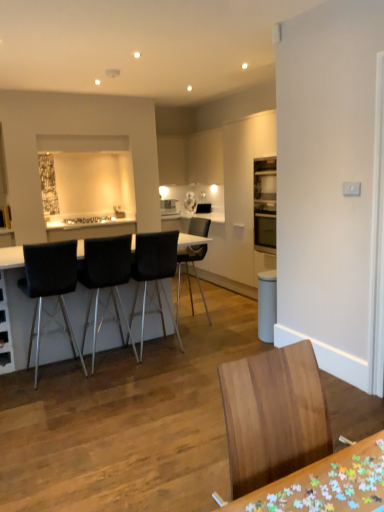
What is the approximate height of black leather chair at left, the 2th chair from the front?

The height of black leather chair at left, the 2th chair from the front, is 3.65 feet.

How much space does black leather bar stool at left, arranged as the 3th chair when viewed from the front, occupy horizontally?

It is 20.70 inches.

At what (x,y) coordinates should I click in order to perform the action: click on black leather chair at center, placed as the 5th chair when sorted from front to back. Please return your answer as a coordinate pair (x, y). Looking at the image, I should click on 189,274.

At what (x,y) coordinates should I click in order to perform the action: click on wooden chair at center, the first chair viewed from the front. Please return your answer as a coordinate pair (x, y). Image resolution: width=384 pixels, height=512 pixels. Looking at the image, I should click on (273, 415).

You are a GUI agent. You are given a task and a screenshot of the screen. Output one action in this format:
    pyautogui.click(x=<x>, y=<y>)
    Task: Click on the black leather table at center, the 1th table in the back-to-front sequence
    This screenshot has width=384, height=512.
    Given the screenshot: What is the action you would take?
    pyautogui.click(x=11, y=257)

Measure the distance between black leather chair at center, placed as the 5th chair when sorted from front to back, and wooden puzzle pieces at lower right, the 1th table positioned from the bottom.

black leather chair at center, placed as the 5th chair when sorted from front to back, is 4.32 meters away from wooden puzzle pieces at lower right, the 1th table positioned from the bottom.

From the image's perspective, which is below, black leather chair at center, placed as the 5th chair when sorted from front to back, or wooden puzzle pieces at lower right, positioned as the 2th table in top-to-bottom order?

wooden puzzle pieces at lower right, positioned as the 2th table in top-to-bottom order, appears lower in the image.

Which point is more distant from viewer, (181, 255) or (359, 508)?

The point (181, 255) is more distant.

Does black leather chair at center, acting as the first chair starting from the back, have a lesser width compared to wooden puzzle pieces at lower right, which appears as the first table when viewed from the right?

No, black leather chair at center, acting as the first chair starting from the back, is not thinner than wooden puzzle pieces at lower right, which appears as the first table when viewed from the right.

What's the angular difference between wooden chair at center, the first chair viewed from the front, and wooden puzzle pieces at lower right, acting as the 2th table starting from the left,'s facing directions?

The angular difference between wooden chair at center, the first chair viewed from the front, and wooden puzzle pieces at lower right, acting as the 2th table starting from the left, is 179 degrees.

Find the location of a particular element. the 1st table above when counting from the wooden chair at center, acting as the fifth chair starting from the back (from the image's perspective) is located at coordinates (326, 484).

Is wooden chair at center, the first chair viewed from the front, beside wooden puzzle pieces at lower right, which ranks as the 1th table in front-to-back order?

wooden chair at center, the first chair viewed from the front, and wooden puzzle pieces at lower right, which ranks as the 1th table in front-to-back order, are clearly separated.

Which object is further away from the camera, wooden chair at center, acting as the fifth chair starting from the back, or wooden puzzle pieces at lower right, the 1th table positioned from the bottom?

wooden puzzle pieces at lower right, the 1th table positioned from the bottom, is behind.

Looking at this image, is wooden puzzle pieces at lower right, which appears as the 2th table when viewed from the back, outside of black leather chair at center, the fourth chair from the front?

Yes, wooden puzzle pieces at lower right, which appears as the 2th table when viewed from the back, is outside of black leather chair at center, the fourth chair from the front.

Considering the positions of objects wooden puzzle pieces at lower right, the 1th table positioned from the bottom, and black leather chair at center, the fourth chair from the front, in the image provided, who is more to the right, wooden puzzle pieces at lower right, the 1th table positioned from the bottom, or black leather chair at center, the fourth chair from the front,?

wooden puzzle pieces at lower right, the 1th table positioned from the bottom, is more to the right.

Is wooden puzzle pieces at lower right, which appears as the first table when viewed from the right, far away from black leather chair at center, the fourth chair from the front?

Yes, wooden puzzle pieces at lower right, which appears as the first table when viewed from the right, and black leather chair at center, the fourth chair from the front, are located far from each other.

Looking at this image, considering the sizes of objects black leather chair at center, placed as the 5th chair when sorted from front to back, and black leather bar stool at left, arranged as the 3th chair when viewed from the front, in the image provided, who is taller, black leather chair at center, placed as the 5th chair when sorted from front to back, or black leather bar stool at left, arranged as the 3th chair when viewed from the front,?

Standing taller between the two is black leather bar stool at left, arranged as the 3th chair when viewed from the front.

From the image's perspective, is black leather chair at center, acting as the first chair starting from the back, above black leather bar stool at left, arranged as the 3th chair when viewed from the front?

Correct, black leather chair at center, acting as the first chair starting from the back, appears higher than black leather bar stool at left, arranged as the 3th chair when viewed from the front, in the image.

Is point (198, 253) closer to viewer compared to point (86, 286)?

No, (198, 253) is behind (86, 286).

Is black leather chair at center, acting as the first chair starting from the back, aimed at black leather bar stool at left, the 3th chair when ordered from back to front?

No, black leather chair at center, acting as the first chair starting from the back, is not aimed at black leather bar stool at left, the 3th chair when ordered from back to front.

How distant is black leather table at center, the 1th table in the back-to-front sequence, from black leather bar stool at left, arranged as the 3th chair when viewed from the front?

black leather table at center, the 1th table in the back-to-front sequence, and black leather bar stool at left, arranged as the 3th chair when viewed from the front, are 68.98 centimeters apart.

Considering their positions, is black leather table at center, the 1th table from the left, located in front of or behind black leather bar stool at left, arranged as the 3th chair when viewed from the front?

black leather table at center, the 1th table from the left, is in front of black leather bar stool at left, arranged as the 3th chair when viewed from the front.

Consider the image. Which object is thinner, black leather table at center, the 1th table in the back-to-front sequence, or black leather bar stool at left, the 3th chair when ordered from back to front?

black leather bar stool at left, the 3th chair when ordered from back to front.

Based on the photo, from the image's perspective, is black leather table at center, the 1th table from the left, located above or below black leather bar stool at left, arranged as the 3th chair when viewed from the front?

Clearly, from the image's perspective, black leather table at center, the 1th table from the left, is below black leather bar stool at left, arranged as the 3th chair when viewed from the front.

Considering the relative positions of white glossy microwave at upper center and black leather bar stool at left, arranged as the 3th chair when viewed from the front, in the image provided, is white glossy microwave at upper center to the right of black leather bar stool at left, arranged as the 3th chair when viewed from the front, from the viewer's perspective?

Yes.

At what (x,y) coordinates should I click in order to perform the action: click on kitchen appliance behind the black leather bar stool at left, the 3th chair when ordered from back to front. Please return your answer as a coordinate pair (x, y). This screenshot has height=512, width=384. Looking at the image, I should click on (190, 202).

Can you confirm if white glossy microwave at upper center is shorter than black leather bar stool at left, the 3th chair when ordered from back to front?

Yes, white glossy microwave at upper center is shorter than black leather bar stool at left, the 3th chair when ordered from back to front.

Does point (191, 200) come closer to viewer compared to point (85, 278)?

No, (191, 200) is behind (85, 278).

Considering the positions of objects black leather table at center, marked as the second table in a right-to-left arrangement, and black leather chair at center, acting as the first chair starting from the back, in the image provided, who is more to the left, black leather table at center, marked as the second table in a right-to-left arrangement, or black leather chair at center, acting as the first chair starting from the back,?

black leather table at center, marked as the second table in a right-to-left arrangement.

From the image's perspective, is black leather table at center, marked as the second table in a right-to-left arrangement, on top of black leather chair at center, acting as the first chair starting from the back?

Actually, black leather table at center, marked as the second table in a right-to-left arrangement, appears below black leather chair at center, acting as the first chair starting from the back, in the image.

Is black leather chair at center, acting as the first chair starting from the back, inside black leather table at center, marked as the second table in a right-to-left arrangement?

Yes, black leather chair at center, acting as the first chair starting from the back, is a part of black leather table at center, marked as the second table in a right-to-left arrangement.

Where is `chair that is the 4th one when counting backward from the wooden puzzle pieces at lower right, acting as the 2th table starting from the left`? This screenshot has height=512, width=384. chair that is the 4th one when counting backward from the wooden puzzle pieces at lower right, acting as the 2th table starting from the left is located at coordinates (189, 274).

The image size is (384, 512). I want to click on table that is the 1st object located above the wooden chair at center, acting as the fifth chair starting from the back (from the image's perspective), so click(x=326, y=484).

Considering their positions, is wooden puzzle pieces at lower right, the 1th table positioned from the bottom, positioned closer to black leather table at center, the 1th table from the left, than black leather chair at center, the fourth chair from the front?

Based on the image, black leather chair at center, the fourth chair from the front, appears to be nearer to black leather table at center, the 1th table from the left.

Based on their spatial positions, is white glossy microwave at upper center or wooden puzzle pieces at lower right, positioned as the 2th table in top-to-bottom order, closer to black leather table at center, positioned as the 2th table in front-to-back order?

wooden puzzle pieces at lower right, positioned as the 2th table in top-to-bottom order, lies closer to black leather table at center, positioned as the 2th table in front-to-back order, than the other object.

Estimate the real-world distances between objects in this image. Which object is further from wooden puzzle pieces at lower right, which appears as the 2th table when viewed from the back, white glossy microwave at upper center or black leather chair at center, the 2th chair viewed from the back?

Based on the image, white glossy microwave at upper center appears to be further to wooden puzzle pieces at lower right, which appears as the 2th table when viewed from the back.

Estimate the real-world distances between objects in this image. Which object is closer to wooden puzzle pieces at lower right, which ranks as the 1th table in front-to-back order, black leather chair at center, the fourth chair from the front, or black leather bar stool at left, the 3th chair when ordered from back to front?

Based on the image, black leather bar stool at left, the 3th chair when ordered from back to front, appears to be nearer to wooden puzzle pieces at lower right, which ranks as the 1th table in front-to-back order.

When comparing their distances from black leather table at center, marked as the second table in a right-to-left arrangement, does black leather bar stool at left, arranged as the 3th chair when viewed from the front, or black leather chair at center, placed as the 5th chair when sorted from front to back, seem further?

The object further to black leather table at center, marked as the second table in a right-to-left arrangement, is black leather chair at center, placed as the 5th chair when sorted from front to back.

Estimate the real-world distances between objects in this image. Which object is further from black leather chair at left, the 2th chair from the front, black leather bar stool at left, the 3th chair when ordered from back to front, or white glossy microwave at upper center?

white glossy microwave at upper center.

Estimate the real-world distances between objects in this image. Which object is further from wooden puzzle pieces at lower right, acting as the 2th table starting from the left, black leather chair at center, acting as the first chair starting from the back, or wooden chair at center, acting as the fifth chair starting from the back?

black leather chair at center, acting as the first chair starting from the back, is positioned further to the anchor wooden puzzle pieces at lower right, acting as the 2th table starting from the left.

From the image, which object appears to be nearer to black leather table at center, placed as the 1th table when sorted from top to bottom, black leather chair at center, placed as the 5th chair when sorted from front to back, or wooden puzzle pieces at lower right, acting as the 2th table starting from the left?

The object closer to black leather table at center, placed as the 1th table when sorted from top to bottom, is black leather chair at center, placed as the 5th chair when sorted from front to back.

Where is `chair situated between black leather chair at left, the 2th chair from the front, and black leather chair at center, the fourth chair from the front, from left to right`? This screenshot has height=512, width=384. chair situated between black leather chair at left, the 2th chair from the front, and black leather chair at center, the fourth chair from the front, from left to right is located at coordinates (105, 278).

This screenshot has height=512, width=384. In order to click on chair between wooden chair at center, the first chair viewed from the front, and black leather bar stool at left, the 3th chair when ordered from back to front, from front to back in this screenshot , I will do (x=50, y=287).

Where is `table between wooden puzzle pieces at lower right, positioned as the 2th table in top-to-bottom order, and black leather chair at center, acting as the first chair starting from the back, from front to back`? Image resolution: width=384 pixels, height=512 pixels. table between wooden puzzle pieces at lower right, positioned as the 2th table in top-to-bottom order, and black leather chair at center, acting as the first chair starting from the back, from front to back is located at coordinates pyautogui.click(x=11, y=257).

Where is `chair between black leather chair at center, the fourth chair from the front, and white glossy microwave at upper center in the front-back direction`? chair between black leather chair at center, the fourth chair from the front, and white glossy microwave at upper center in the front-back direction is located at coordinates (189, 274).